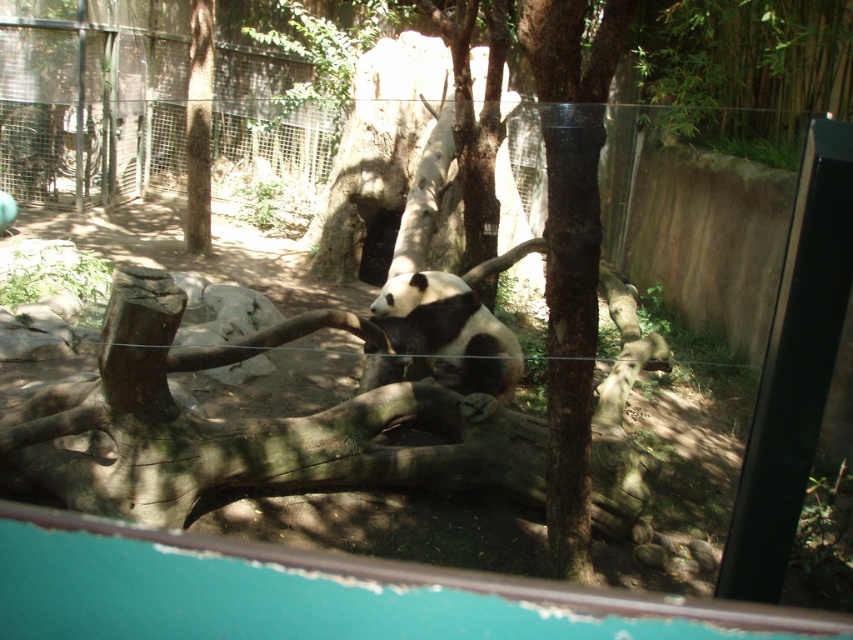
Can you confirm if black and white fur at center is wider than brown rough tree trunk at upper left?

Indeed, black and white fur at center has a greater width compared to brown rough tree trunk at upper left.

Measure the distance between black and white fur at center and camera.

The distance of black and white fur at center from camera is 15.57 feet.

You are a GUI agent. You are given a task and a screenshot of the screen. Output one action in this format:
    pyautogui.click(x=<x>, y=<y>)
    Task: Click on the black and white fur at center
    The image size is (853, 640).
    Given the screenshot: What is the action you would take?
    pyautogui.click(x=442, y=336)